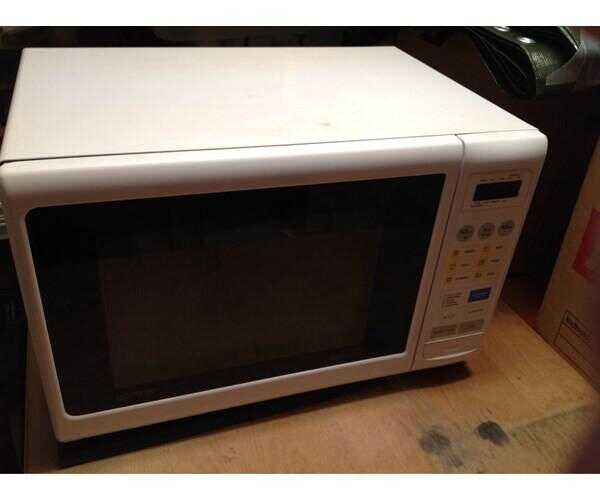
Locate an element on the screen. 3 white rectangles on microwave is located at coordinates (447, 315), (478, 310), (456, 298).